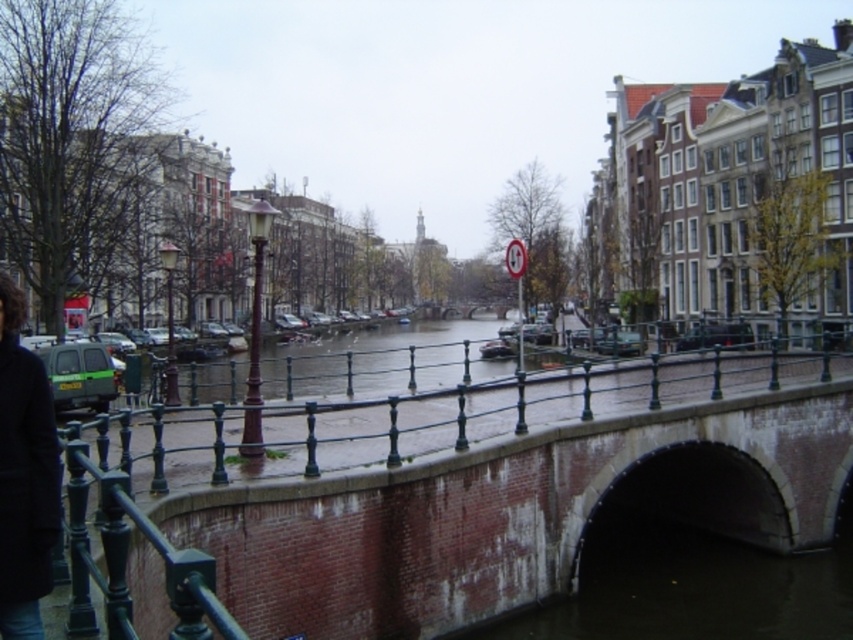
Question: Which object is closer to the camera taking this photo?

Choices:
 (A) brick bridge at center
 (B) black wool coat at lower left

Answer: (A)

Question: Is brick bridge at center further to the viewer compared to black wool coat at lower left?

Choices:
 (A) yes
 (B) no

Answer: (B)

Question: Which point is closer to the camera taking this photo?

Choices:
 (A) (33, 420)
 (B) (752, 387)

Answer: (A)

Question: Where is brick bridge at center located in relation to black wool coat at lower left in the image?

Choices:
 (A) above
 (B) below

Answer: (B)

Question: Can you confirm if brick bridge at center is positioned to the right of black wool coat at lower left?

Choices:
 (A) yes
 (B) no

Answer: (A)